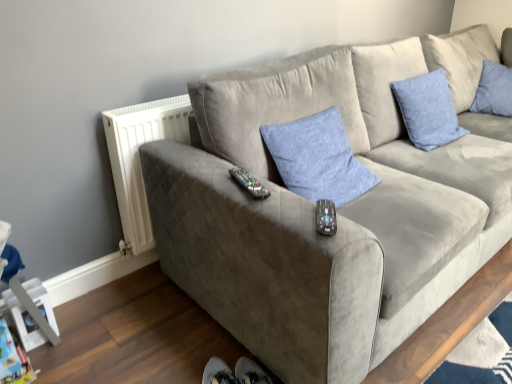
Question: In terms of size, does black plastic remote at center, positioned as the first remote in bottom-to-top order, appear bigger or smaller than blue fabric pillow at center, which appears as the 2th pillow when viewed from the back?

Choices:
 (A) big
 (B) small

Answer: (B)

Question: From a real-world perspective, is black plastic remote at center, the 1th remote positioned from the right, positioned above or below blue fabric pillow at center, the 2th pillow viewed from the right?

Choices:
 (A) above
 (B) below

Answer: (A)

Question: Estimate the real-world distances between objects in this image. Which object is closer to the black plastic remote at center, arranged as the first remote when viewed from the front?

Choices:
 (A) suede gray couch at center
 (B) white plastic radiator at left
 (C) blue fabric pillow at center, the 2th pillow viewed from the right
 (D) blue textured pillow at upper right, which appears as the 2th pillow when viewed from the front
 (E) black plastic remote at center, the first remote when ordered from back to front

Answer: (E)

Question: Which object is positioned closest to the white plastic radiator at left?

Choices:
 (A) black plastic remote at center, which is the first remote in top-to-bottom order
 (B) suede gray couch at center
 (C) blue textured pillow at upper right, the second pillow when ordered from left to right
 (D) blue fabric pillow at center, the first pillow in the left-to-right sequence
 (E) black plastic remote at center, positioned as the 2th remote in back-to-front order

Answer: (D)